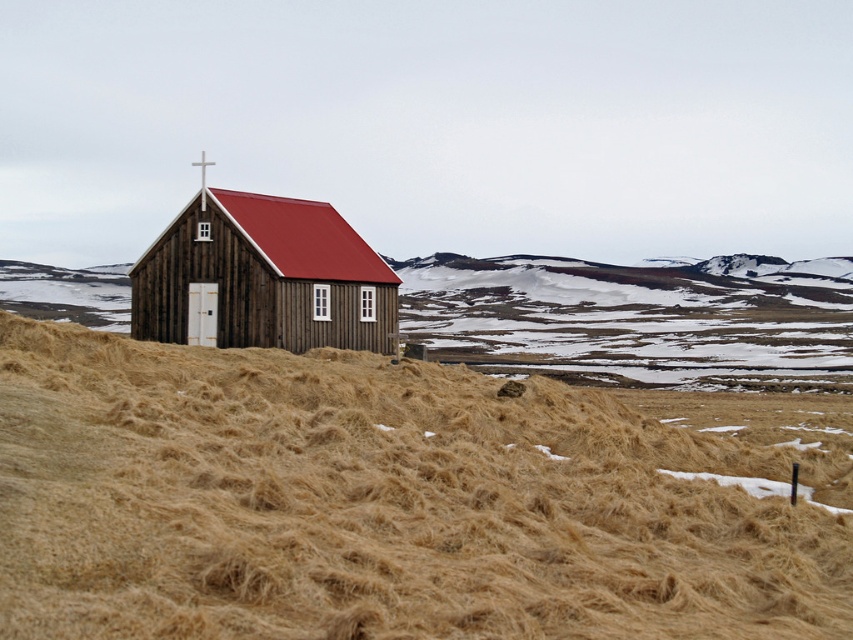
Question: Which of the following is the closest to the observer?

Choices:
 (A) (318, 424)
 (B) (277, 225)

Answer: (A)

Question: Does brown dry grass at lower center appear under wooden chapel at center?

Choices:
 (A) yes
 (B) no

Answer: (A)

Question: Is brown dry grass at lower center wider than wooden chapel at center?

Choices:
 (A) yes
 (B) no

Answer: (A)

Question: Can you confirm if brown dry grass at lower center is positioned below wooden chapel at center?

Choices:
 (A) yes
 (B) no

Answer: (A)

Question: Which point appears farthest from the camera in this image?

Choices:
 (A) (262, 234)
 (B) (221, 480)

Answer: (A)